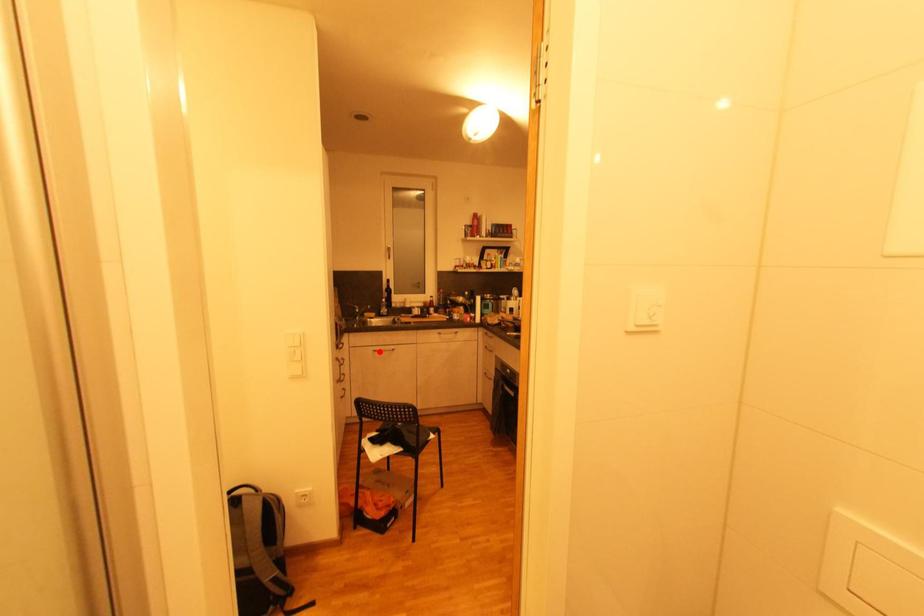
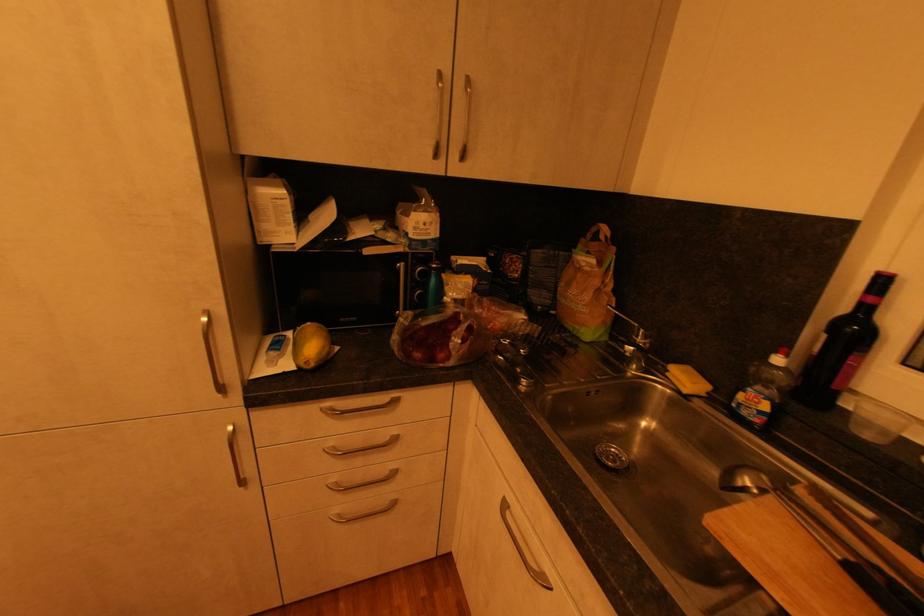
Where in the second image is the point corresponding to the highlighted location from the first image?

(508, 507)